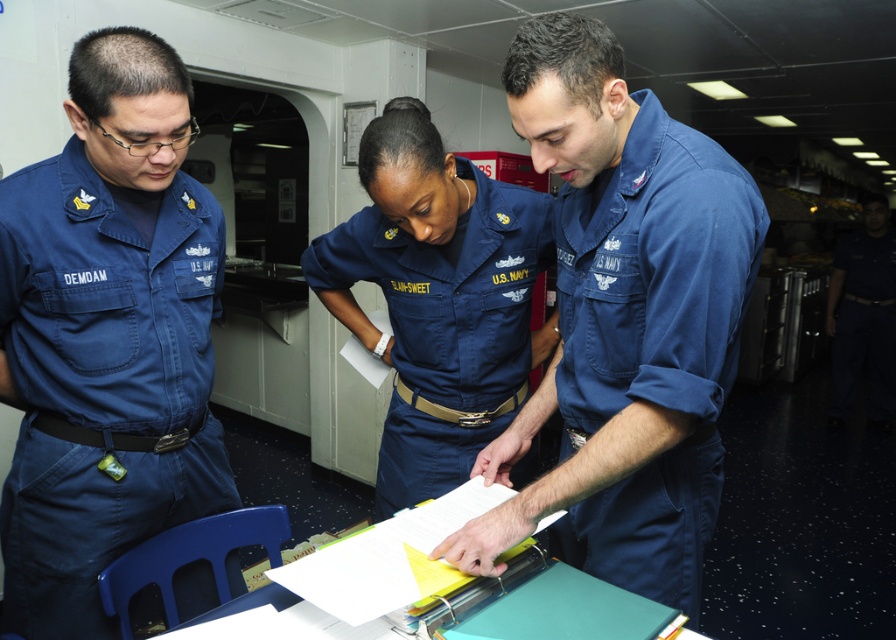
What is located at the coordinate point (102, 380) in the image?

The blue cotton shirt at left is located at the coordinate point (102, 380).

In the scene where three U.S. Navy personnel are discussing documents at a table on a ship, you need to determine which clothing item is closer to you. The two items in question are the blue cotton shirt at center and the navy blue fabric uniform at center. Which one is positioned in front?

The blue cotton shirt at center is in front of the navy blue fabric uniform at center, so the blue cotton shirt at center is closer to you.

You are a new crew member on the ship and need to find the person wearing the navy blue fabric uniform at center. Where should you look relative to the person wearing the blue cotton shirt at left?

The navy blue fabric uniform at center is to the right of the blue cotton shirt at left, so you should look to the right of the blue cotton shirt at left to find the navy blue fabric uniform at center.